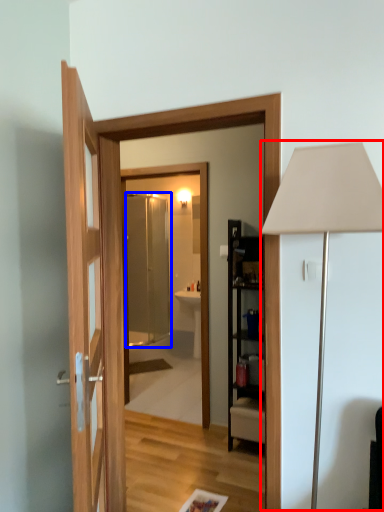
Question: Among these objects, which one is farthest to the camera, table lamp (highlighted by a red box) or screen door (highlighted by a blue box)?

Choices:
 (A) table lamp
 (B) screen door

Answer: (B)